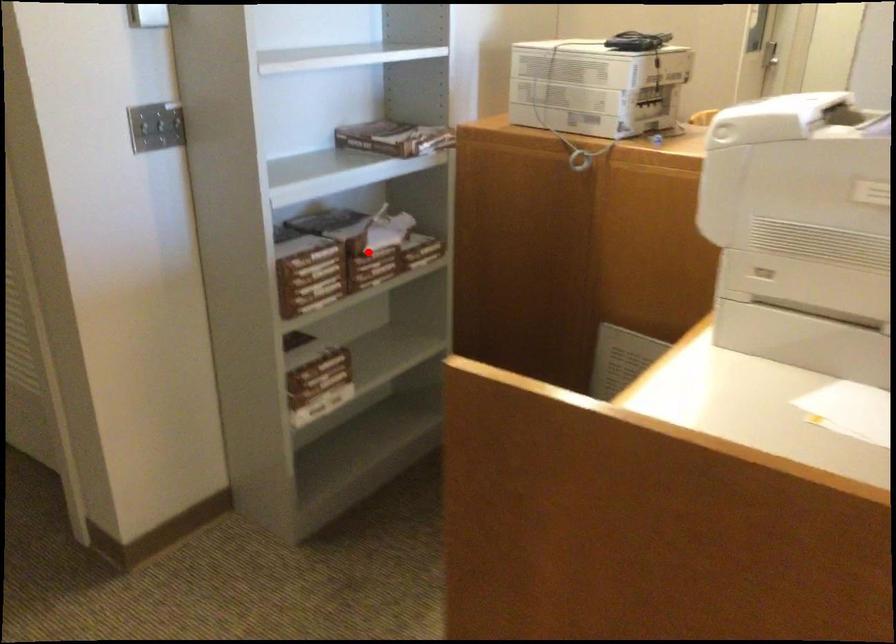
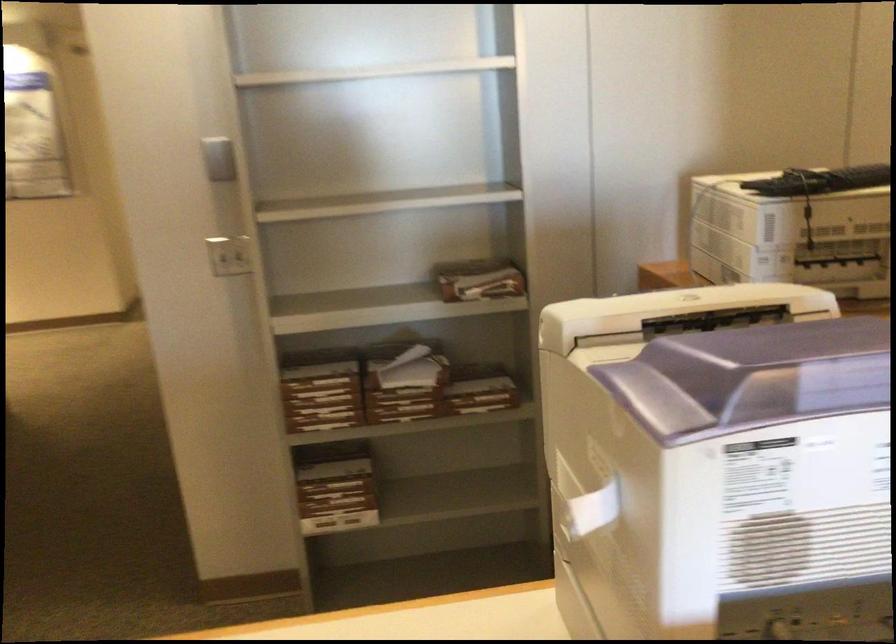
Find the pixel in the second image that matches the highlighted location in the first image.

(398, 389)